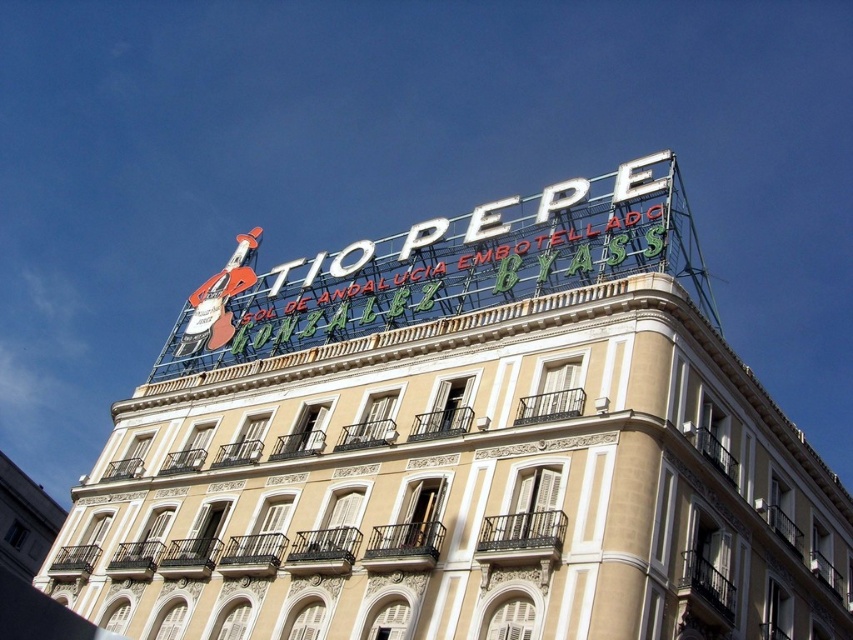
The height and width of the screenshot is (640, 853). Find the location of `beige stone building at center`. beige stone building at center is located at coordinates (466, 488).

Between point (547, 584) and point (502, 218), which one is positioned behind?

Point (502, 218)

In order to click on beige stone building at center in this screenshot , I will do `click(466, 488)`.